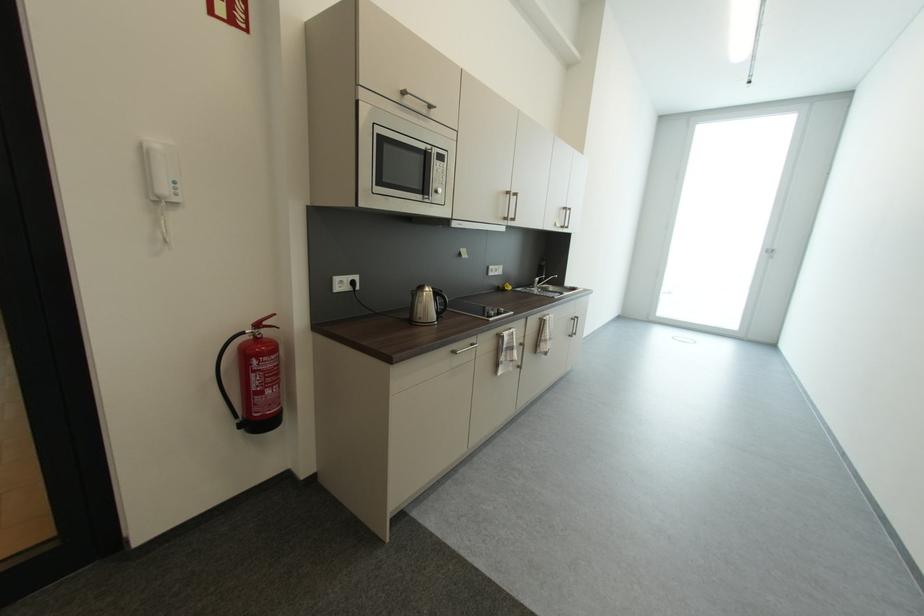
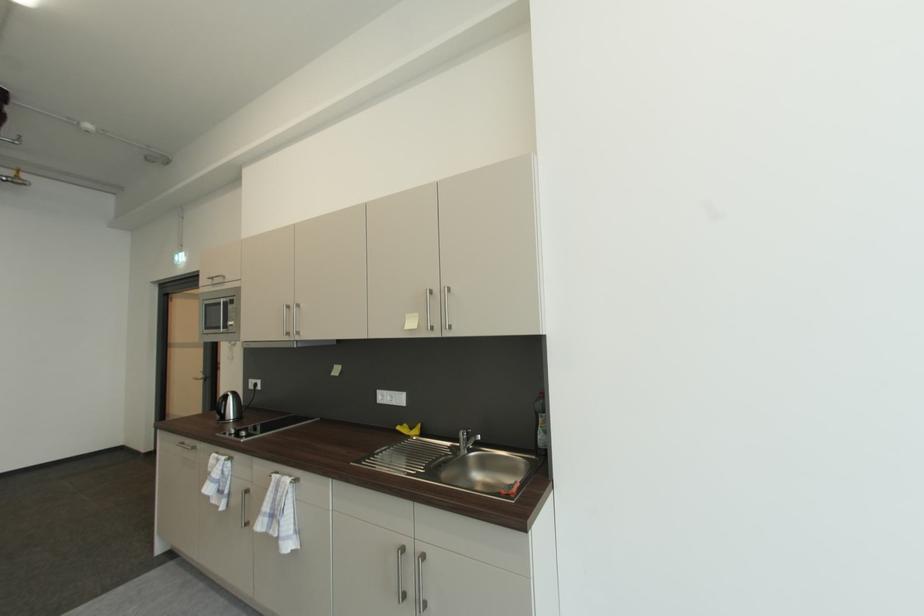
In the second image, find the point that corresponds to (x=552, y=321) in the first image.

(277, 477)